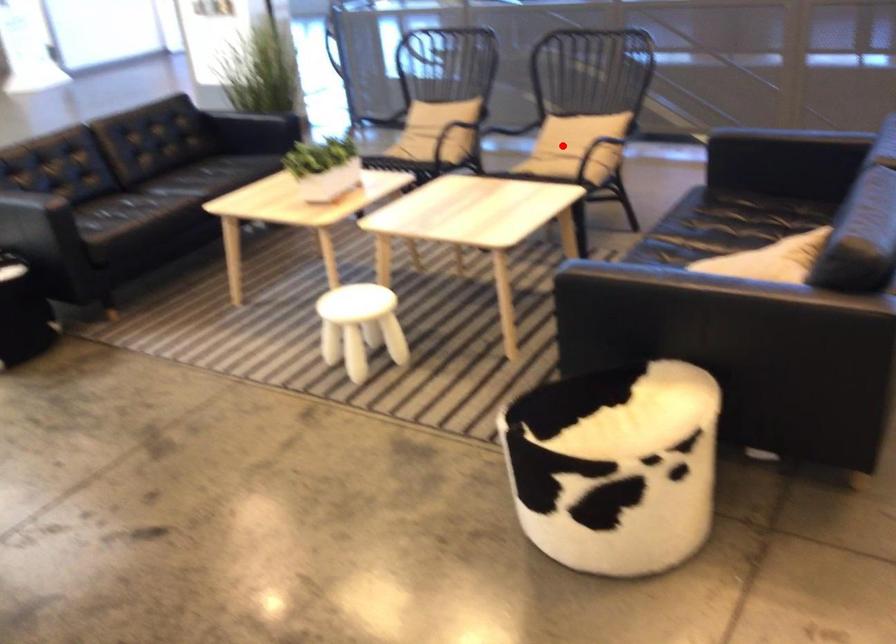
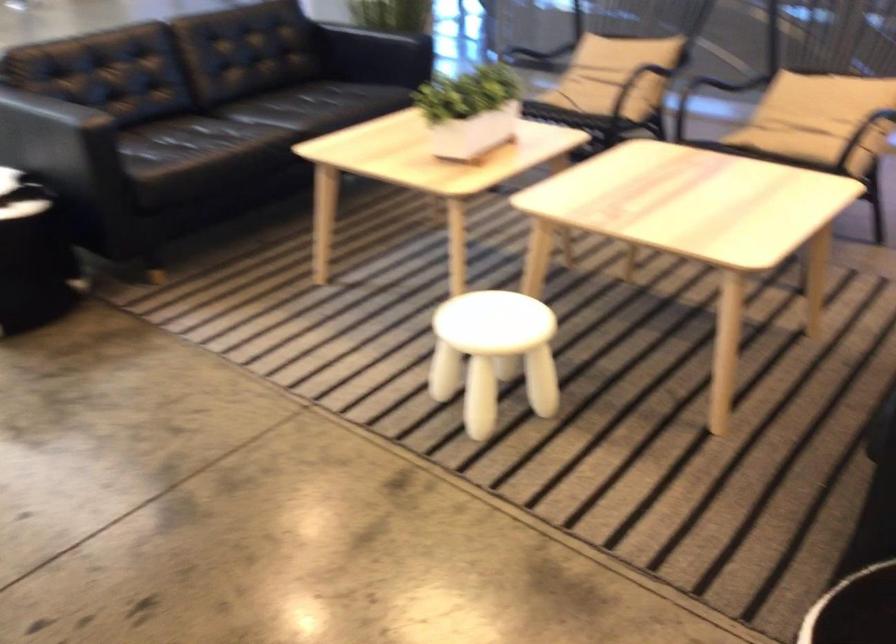
Question: I am providing you with two images of the same scene from different viewpoints. A red point is shown in image1. For the corresponding object point in image2, is it positioned nearer or farther from the camera?

Choices:
 (A) Nearer
 (B) Farther

Answer: (A)